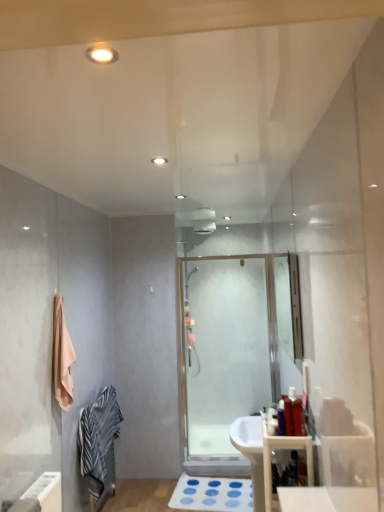
Question: Is the depth of wooden storage at lower right less than that of transparent glass shower door at center?

Choices:
 (A) yes
 (B) no

Answer: (A)

Question: Can we say wooden storage at lower right lies outside transparent glass shower door at center?

Choices:
 (A) no
 (B) yes

Answer: (B)

Question: Is wooden storage at lower right shorter than transparent glass shower door at center?

Choices:
 (A) yes
 (B) no

Answer: (A)

Question: Considering the relative positions of wooden storage at lower right and transparent glass shower door at center in the image provided, is wooden storage at lower right to the right of transparent glass shower door at center from the viewer's perspective?

Choices:
 (A) yes
 (B) no

Answer: (A)

Question: Is wooden storage at lower right thinner than transparent glass shower door at center?

Choices:
 (A) no
 (B) yes

Answer: (A)

Question: Considering the relative positions of wooden storage at lower right and transparent glass shower door at center in the image provided, is wooden storage at lower right to the left of transparent glass shower door at center from the viewer's perspective?

Choices:
 (A) yes
 (B) no

Answer: (B)

Question: Considering the relative positions of white glossy light fixture at upper center and transparent glass shower door at center in the image provided, is white glossy light fixture at upper center to the left of transparent glass shower door at center from the viewer's perspective?

Choices:
 (A) yes
 (B) no

Answer: (A)

Question: Is white glossy light fixture at upper center to the right of transparent glass shower door at center from the viewer's perspective?

Choices:
 (A) no
 (B) yes

Answer: (A)

Question: Would you say white glossy light fixture at upper center is outside transparent glass shower door at center?

Choices:
 (A) no
 (B) yes

Answer: (B)

Question: From a real-world perspective, does white glossy light fixture at upper center stand above transparent glass shower door at center?

Choices:
 (A) no
 (B) yes

Answer: (B)

Question: From a real-world perspective, is white glossy light fixture at upper center positioned under transparent glass shower door at center based on gravity?

Choices:
 (A) yes
 (B) no

Answer: (B)

Question: Is white glossy light fixture at upper center taller than transparent glass shower door at center?

Choices:
 (A) no
 (B) yes

Answer: (A)

Question: From the image's perspective, is matte plastic toothbrush at center, arranged as the first toiletry when viewed from the left, located above transparent glass shower door at center?

Choices:
 (A) no
 (B) yes

Answer: (B)